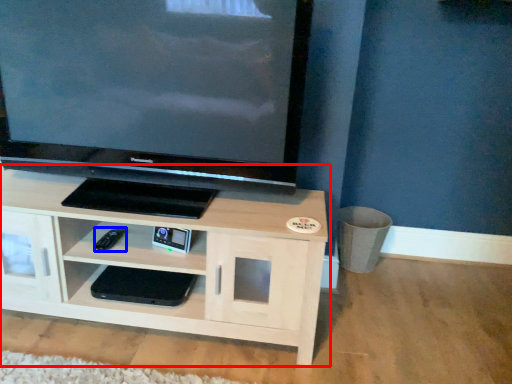
Question: Which point is closer to the camera, shelf (highlighted by a red box) or remote (highlighted by a blue box)?

Choices:
 (A) shelf
 (B) remote

Answer: (A)